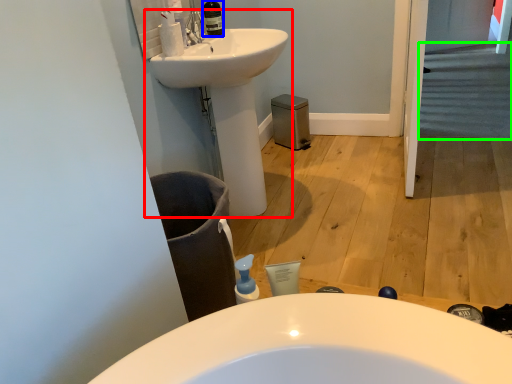
Question: Estimate the real-world distances between objects in this image. Which object is farther from sink (highlighted by a red box), toiletry (highlighted by a blue box) or stairs (highlighted by a green box)?

Choices:
 (A) toiletry
 (B) stairs

Answer: (B)